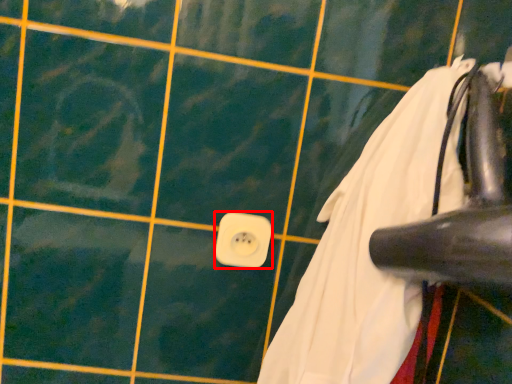
Question: From the image's perspective, where is power plugs and sockets (annotated by the red box) located relative to laundry?

Choices:
 (A) above
 (B) below

Answer: (B)